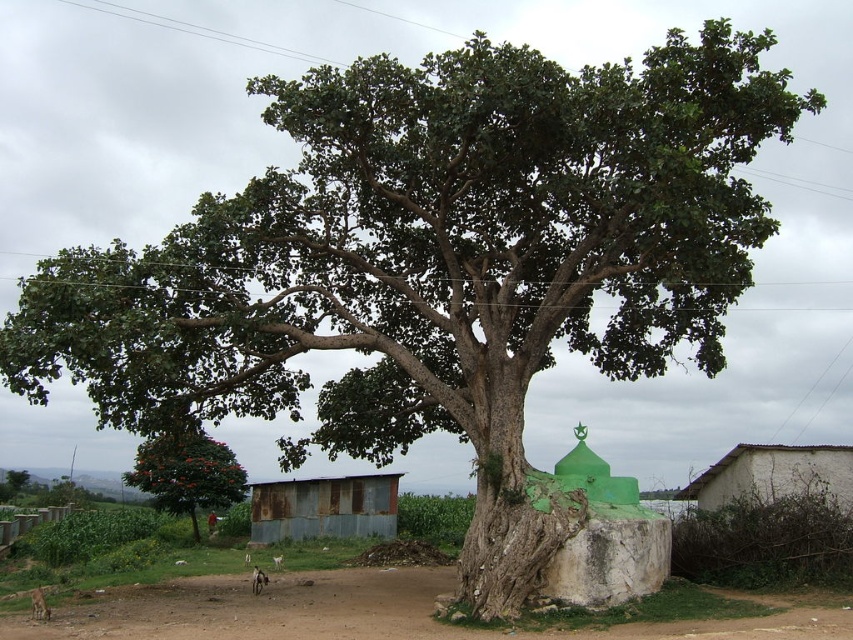
Question: Which object is closer to the camera taking this photo?

Choices:
 (A) green leafy tree at lower left
 (B) rusty metal hut at lower center
 (C) white stucco hut at lower right
 (D) brown dirt field at lower center

Answer: (D)

Question: Does brown dirt field at lower center appear over white stucco hut at lower right?

Choices:
 (A) yes
 (B) no

Answer: (B)

Question: Does brown dirt field at lower center appear over white stucco hut at lower right?

Choices:
 (A) yes
 (B) no

Answer: (B)

Question: Is brown dirt field at lower center smaller than white stucco hut at lower right?

Choices:
 (A) no
 (B) yes

Answer: (A)

Question: Which of these objects is positioned closest to the white stucco hut at lower right?

Choices:
 (A) rusty metal hut at lower center
 (B) brown dirt field at lower center

Answer: (B)

Question: Which of these objects is positioned closest to the white stucco hut at lower right?

Choices:
 (A) green leafy tree at lower left
 (B) brown dirt field at lower center

Answer: (B)